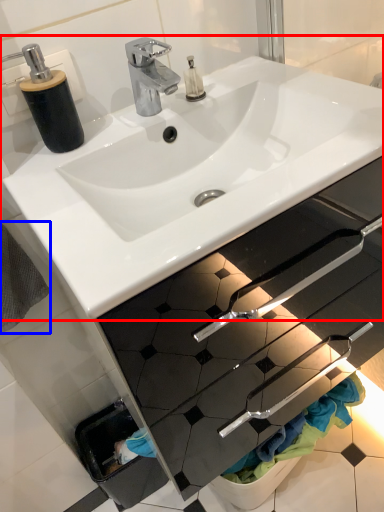
Question: Which object appears closest to the camera in this image, sink (highlighted by a red box) or bath towel (highlighted by a blue box)?

Choices:
 (A) sink
 (B) bath towel

Answer: (A)